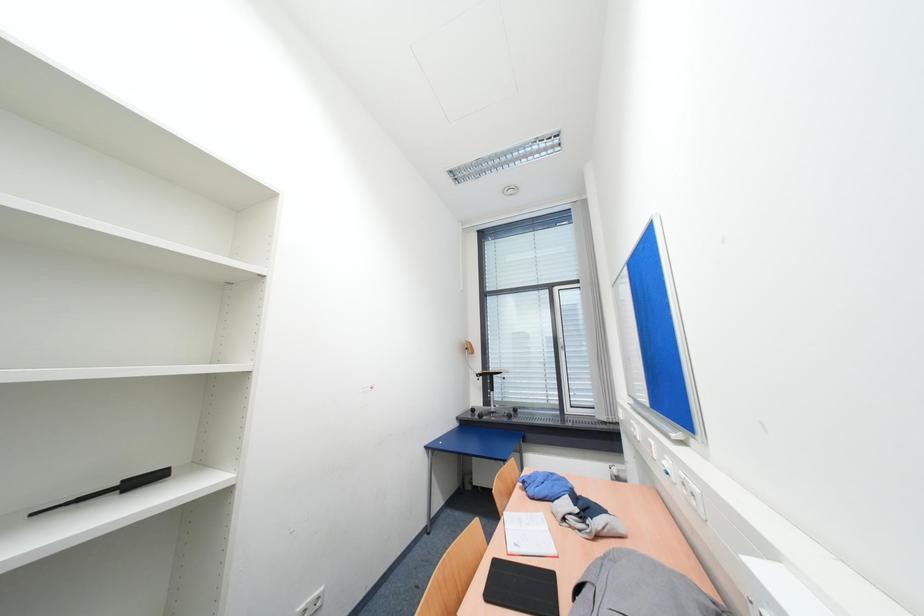
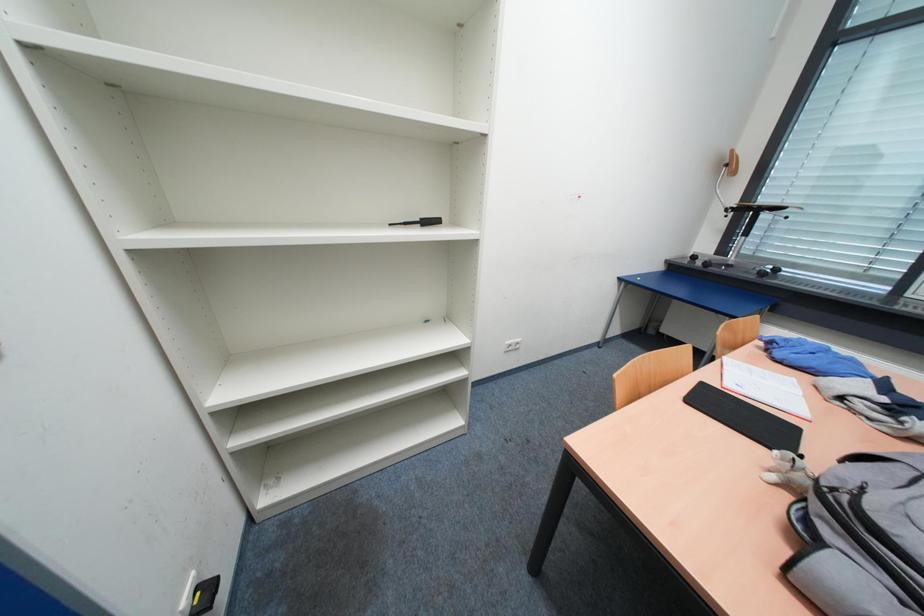
How did the camera likely rotate?

The rotation direction of the camera is left-down.